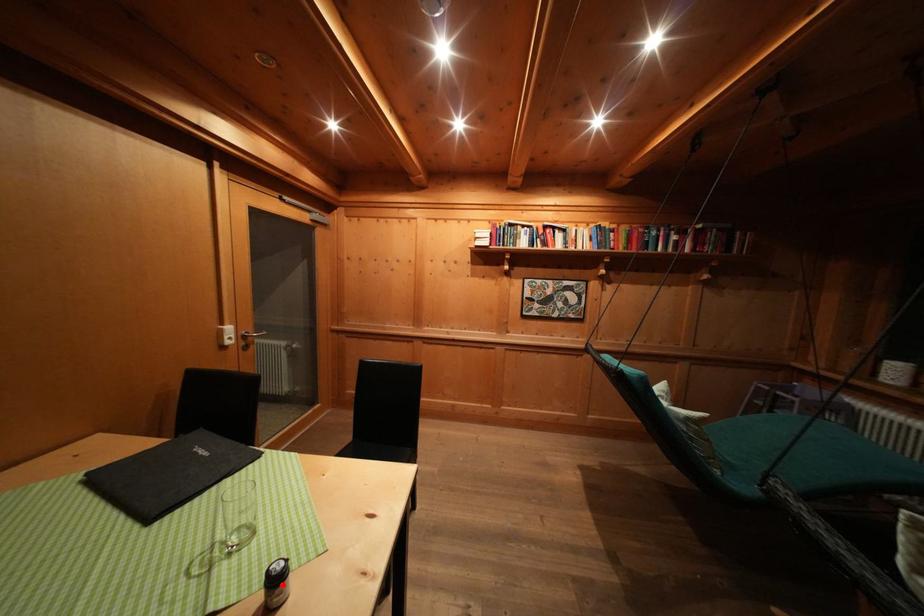
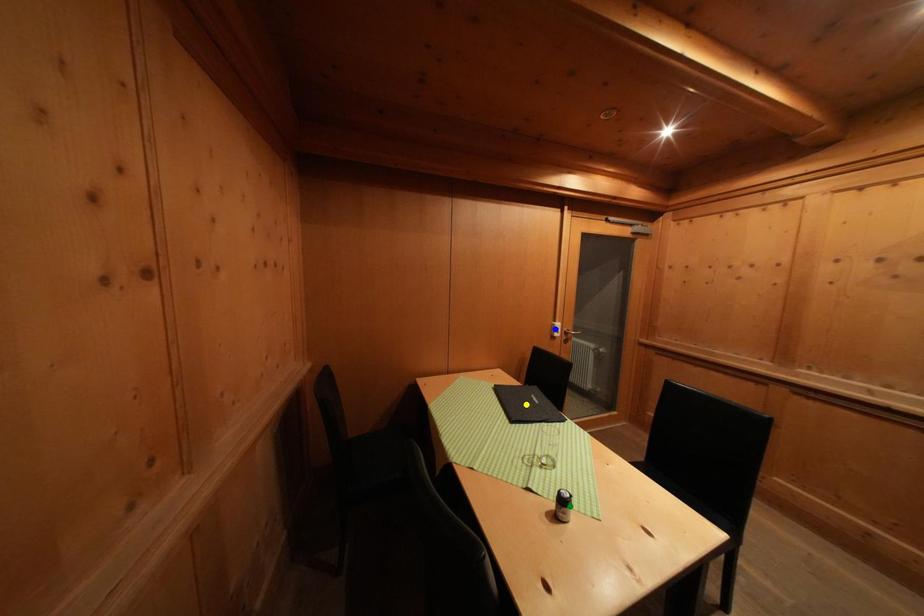
Question: I am providing you with two images of the same scene from different viewpoints. A red point is marked on the first image. You are given multiple points on the second image. In image 2, which mark is for the same physical point as the one in image 1?

Choices:
 (A) yellow point
 (B) blue point
 (C) green point

Answer: (C)